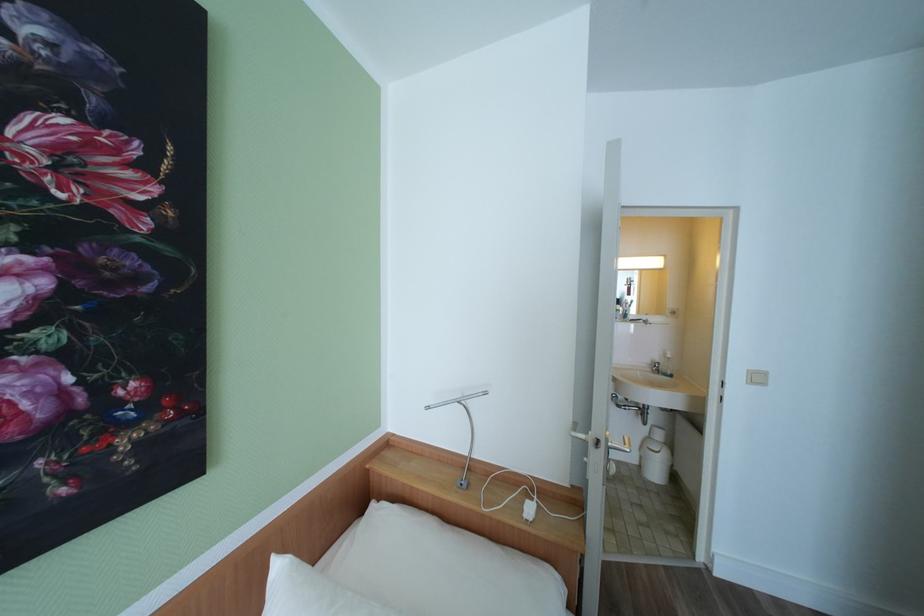
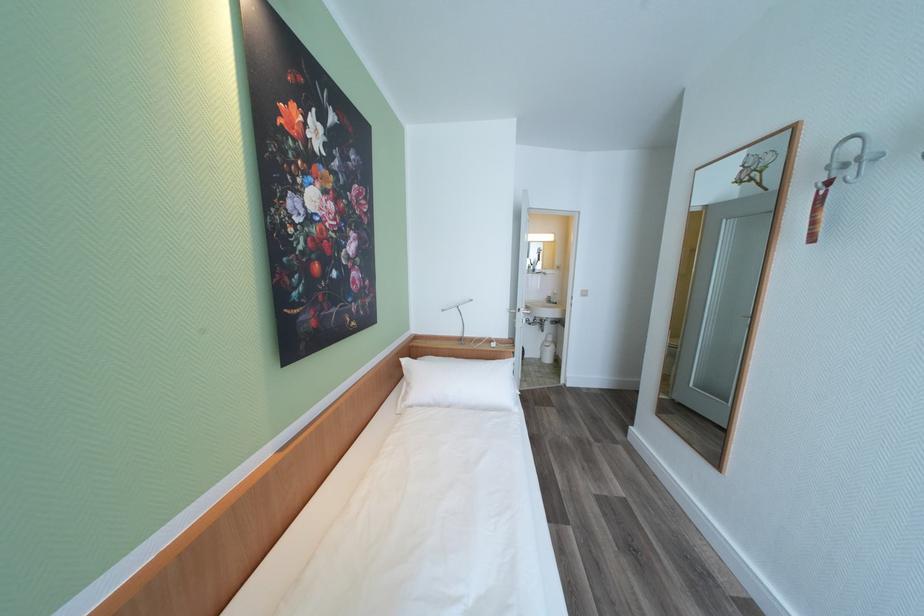
In the second image, find the point that corresponds to point 286,567 in the first image.

(411, 362)